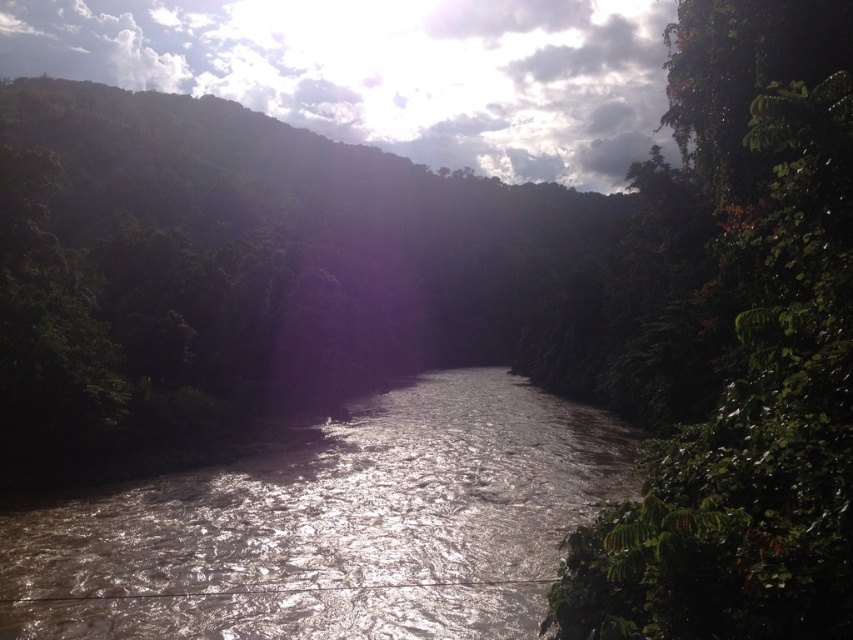
You are standing at the center of the image and want to walk towards the green leafy tree at right. Which direction should you face to head directly towards it?

You should face towards the right direction to head directly towards the green leafy tree at right since it is located at point 0.553 on the x axis which is to the right of the center point 0.5. The coordinates indicate the tree is positioned at the right side of the image.

You are standing at the center of the river in the image. Looking towards the right side of the scene, you see a point marked at coordinates (747, 353). What object is located at that point?

The point at coordinates (747, 353) corresponds to the green leafy tree at right.